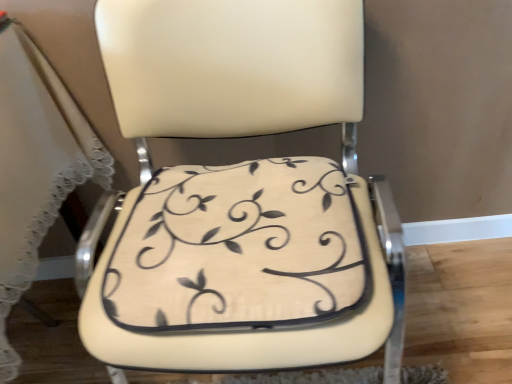
Measure the distance between beige leather chair at center and camera.

beige leather chair at center is 22.36 inches away from camera.

Locate an element on the screen. beige leather chair at center is located at coordinates (240, 196).

This screenshot has width=512, height=384. What do you see at coordinates (240, 196) in the screenshot?
I see `beige leather chair at center` at bounding box center [240, 196].

Identify the location of beige fabric cushion at center. (238, 248).

What do you see at coordinates (238, 248) in the screenshot? I see `beige fabric cushion at center` at bounding box center [238, 248].

Where is `beige leather chair at center`? The width and height of the screenshot is (512, 384). beige leather chair at center is located at coordinates [240, 196].

Based on their positions, is beige leather chair at center located to the left or right of beige fabric cushion at center?

beige leather chair at center is to the right of beige fabric cushion at center.

From the picture: Which object is further away from the camera, beige leather chair at center or beige fabric cushion at center?

beige fabric cushion at center is more distant.

Is point (314, 299) closer or farther from the camera than point (239, 259)?

Clearly, point (314, 299) is closer to the camera than point (239, 259).

From the image's perspective, would you say beige leather chair at center is shown under beige fabric cushion at center?

Actually, beige leather chair at center appears above beige fabric cushion at center in the image.

From a real-world perspective, is beige leather chair at center positioned above or below beige fabric cushion at center?

beige leather chair at center is below beige fabric cushion at center.

Which of these two, beige leather chair at center or beige fabric cushion at center, is thinner?

beige fabric cushion at center.

Does beige leather chair at center have a greater height compared to beige fabric cushion at center?

Yes.

Does beige leather chair at center have a larger size compared to beige fabric cushion at center?

Yes, beige leather chair at center is bigger than beige fabric cushion at center.

Would you say beige leather chair at center contains beige fabric cushion at center?

Yes, beige fabric cushion at center is surrounded by beige leather chair at center.

Is beige leather chair at center directly adjacent to beige fabric cushion at center?

Yes, beige leather chair at center is with beige fabric cushion at center.

Does beige leather chair at center turn towards beige fabric cushion at center?

Yes, beige leather chair at center faces towards beige fabric cushion at center.

How many degrees apart are the facing directions of beige leather chair at center and beige fabric cushion at center?

beige leather chair at center and beige fabric cushion at center are facing 0.544 degrees away from each other.

This screenshot has height=384, width=512. What are the coordinates of `chair that is in front of the beige fabric cushion at center` in the screenshot? It's located at (240, 196).

Based on the photo, which is more to the right, beige fabric cushion at center or beige leather chair at center?

beige leather chair at center is more to the right.

Is beige fabric cushion at center closer to camera compared to beige leather chair at center?

No, beige fabric cushion at center is behind beige leather chair at center.

Is point (346, 243) farther from camera compared to point (344, 27)?

No, (346, 243) is in front of (344, 27).

From the image's perspective, is beige fabric cushion at center beneath beige leather chair at center?

Yes.

From a real-world perspective, is beige fabric cushion at center located higher than beige leather chair at center?

Yes, from a real-world perspective, beige fabric cushion at center is above beige leather chair at center.

Is beige fabric cushion at center wider or thinner than beige leather chair at center?

Considering their sizes, beige fabric cushion at center looks slimmer than beige leather chair at center.

Does beige fabric cushion at center have a lesser height compared to beige leather chair at center?

Yes, beige fabric cushion at center is shorter than beige leather chair at center.

Does beige fabric cushion at center have a larger size compared to beige leather chair at center?

Incorrect, beige fabric cushion at center is not larger than beige leather chair at center.

Is beige leather chair at center inside beige fabric cushion at center?

Actually, beige leather chair at center is outside beige fabric cushion at center.

Does beige fabric cushion at center touch beige leather chair at center?

Yes, the surface of beige fabric cushion at center is in contact with beige leather chair at center.

Could you tell me if beige fabric cushion at center is facing beige leather chair at center?

Yes, beige fabric cushion at center faces towards beige leather chair at center.

What's the angular difference between beige fabric cushion at center and beige leather chair at center's facing directions?

0.544 degrees separate the facing orientations of beige fabric cushion at center and beige leather chair at center.

In order to click on chair in front of the beige fabric cushion at center in this screenshot , I will do `click(240, 196)`.

Find the location of a particular element. This screenshot has width=512, height=384. pillow that appears on the left of beige leather chair at center is located at coordinates (238, 248).

Where is `pillow that is behind the beige leather chair at center`? Image resolution: width=512 pixels, height=384 pixels. pillow that is behind the beige leather chair at center is located at coordinates pyautogui.click(x=238, y=248).